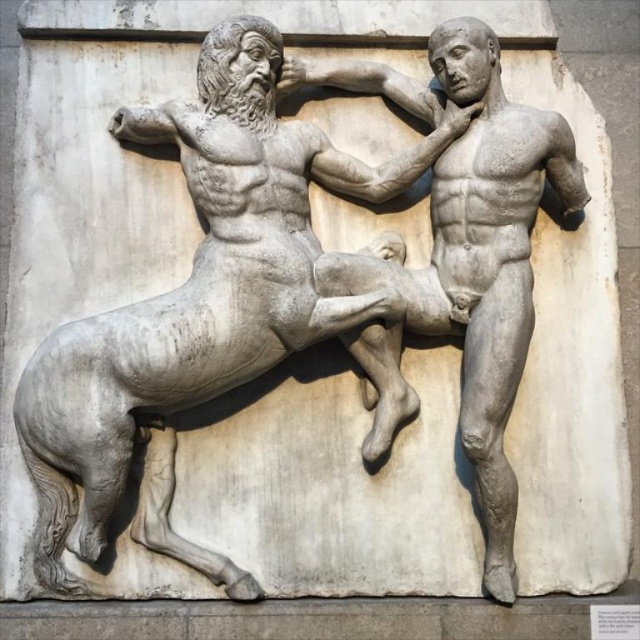
Which is above, white marble horse at center or smooth stone man at center?

smooth stone man at center

Which is below, white marble horse at center or smooth stone man at center?

white marble horse at center is lower down.

Describe the element at coordinates (209, 310) in the screenshot. The width and height of the screenshot is (640, 640). I see `white marble horse at center` at that location.

This screenshot has height=640, width=640. I want to click on white marble horse at center, so click(x=209, y=310).